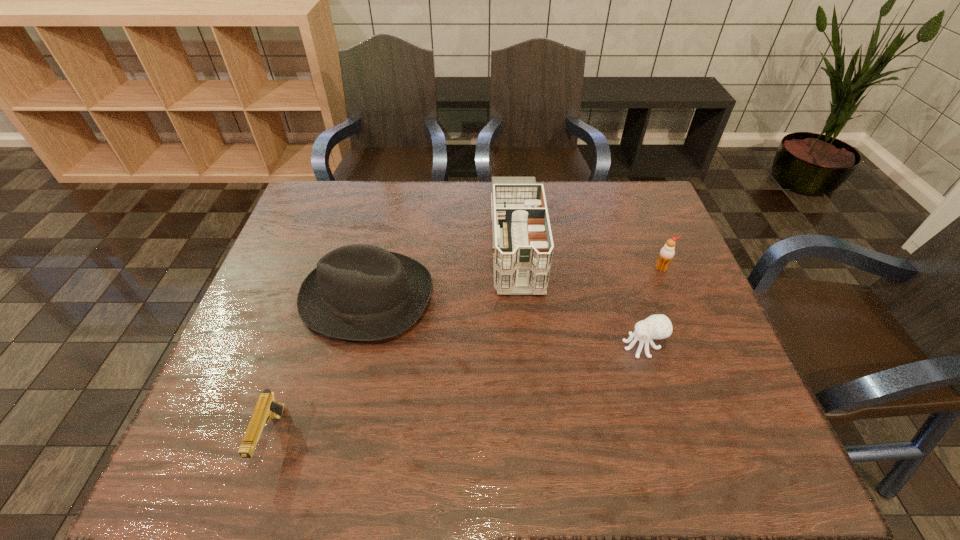
Locate an element on the screen. The width and height of the screenshot is (960, 540). vacant space that is in between the fedora and the shortest object is located at coordinates (319, 368).

At what (x,y) coordinates should I click in order to perform the action: click on blank region between the octopus and the fedora. Please return your answer as a coordinate pair (x, y). Looking at the image, I should click on (505, 322).

The image size is (960, 540). In order to click on free space between the fedora and the nearest object in this screenshot , I will do `click(319, 368)`.

Find the location of `free area in between the rightmost object and the third object from right to left`. free area in between the rightmost object and the third object from right to left is located at coordinates (588, 255).

The width and height of the screenshot is (960, 540). I want to click on vacant space that is in between the octopus and the fedora, so click(505, 322).

Locate an element on the screen. This screenshot has height=540, width=960. object that is the fourth nearest to the pistol is located at coordinates (667, 252).

Select which object appears as the fourth closest to the pistol. Please provide its 2D coordinates. Your answer should be formatted as a tuple, i.e. [(x, y)], where the tuple contains the x and y coordinates of a point satisfying the conditions above.

[(667, 252)]

This screenshot has width=960, height=540. I want to click on free space in the image that satisfies the following two spatial constraints: 1. at the front with a straw on the rightmost object; 2. on the front-facing side of the second object from right to left, so click(692, 346).

Find the location of a particular element. The image size is (960, 540). vacant region that satisfies the following two spatial constraints: 1. on the front-facing side of the octopus; 2. at the barrel of the nearest object is located at coordinates (671, 437).

At what (x,y) coordinates should I click in order to perform the action: click on vacant position in the image that satisfies the following two spatial constraints: 1. on the front-facing side of the octopus; 2. at the barrel of the shortest object. Please return your answer as a coordinate pair (x, y). The width and height of the screenshot is (960, 540). Looking at the image, I should click on (671, 437).